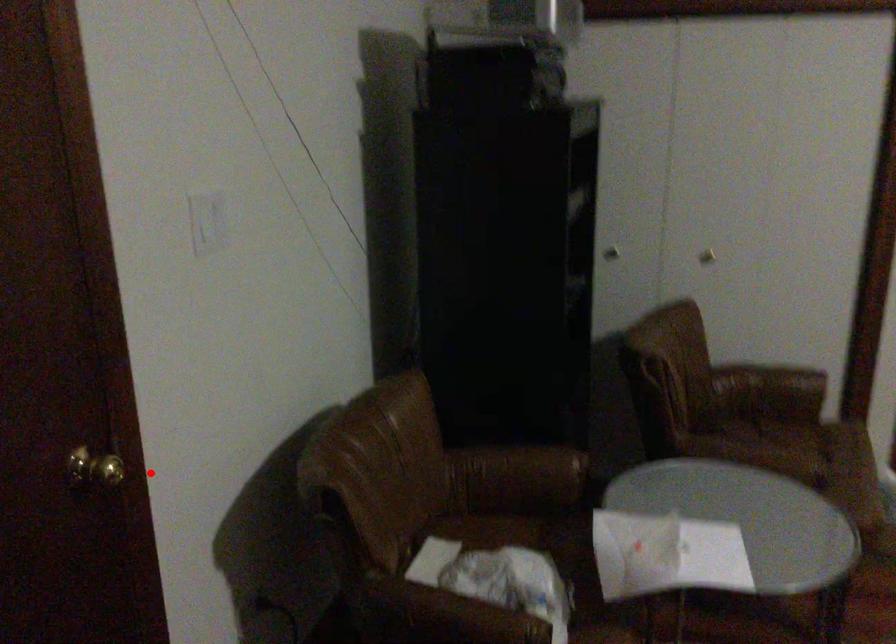
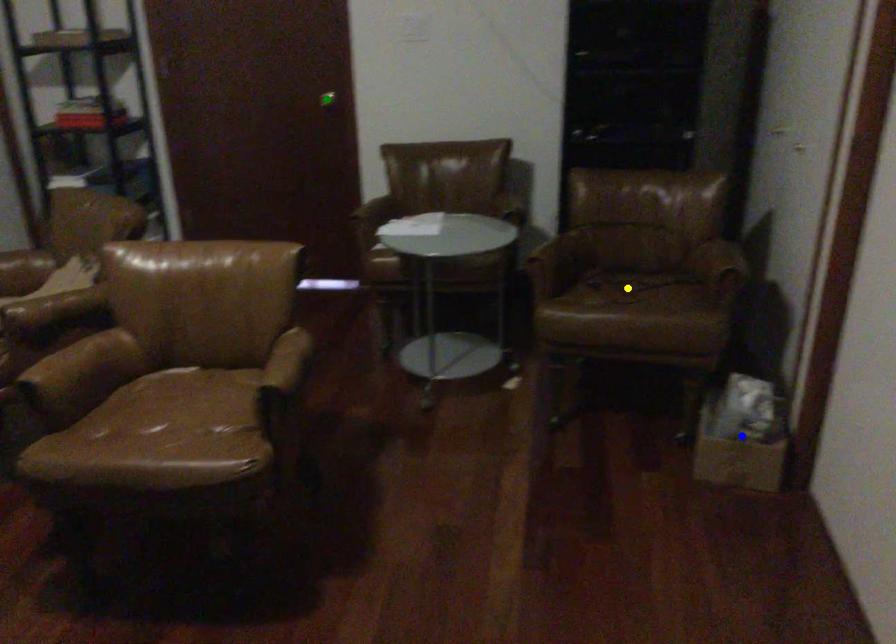
Question: I am providing you with two images of the same scene from different viewpoints. A red point is marked on the first image. You are given multiple points on the second image. Which spot in image 2 lines up with the point in image 1?

Choices:
 (A) blue point
 (B) green point
 (C) yellow point

Answer: (B)